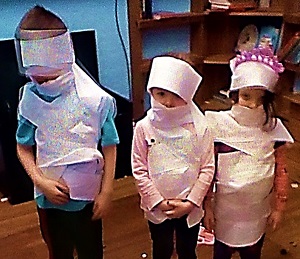
Where is `floor`? floor is located at coordinates (22, 233), (128, 227), (205, 249), (279, 229).